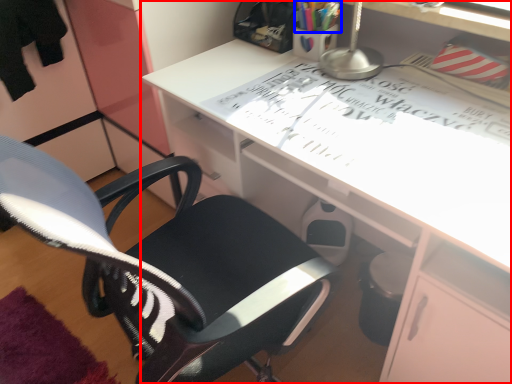
Question: Among these objects, which one is farthest to the camera, desk (highlighted by a red box) or stationery (highlighted by a blue box)?

Choices:
 (A) desk
 (B) stationery

Answer: (B)